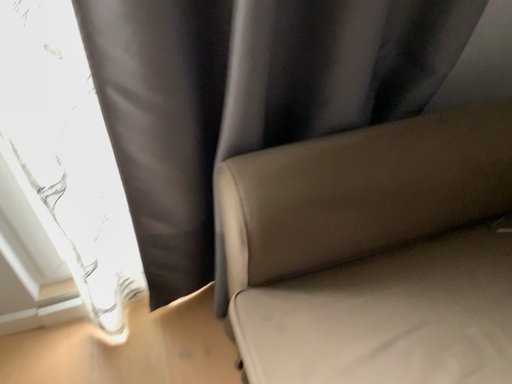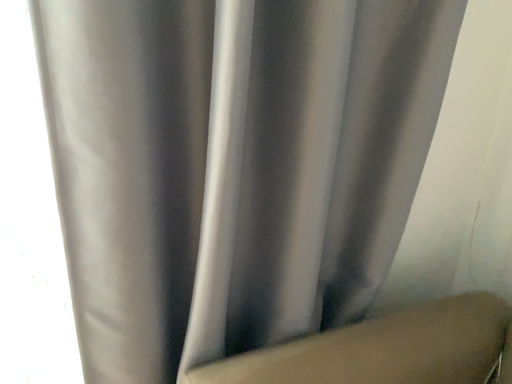
Question: How did the camera likely rotate when shooting the video?

Choices:
 (A) rotated downward
 (B) rotated upward

Answer: (B)